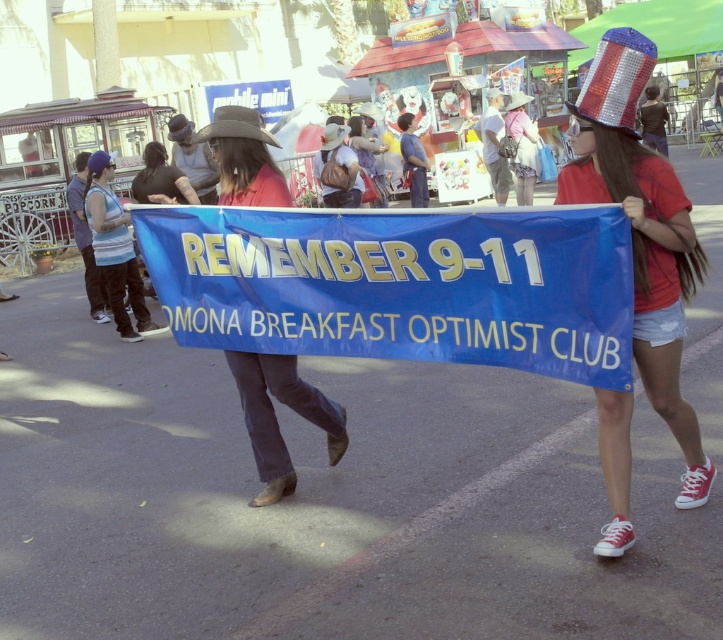
Question: Estimate the real-world distances between objects in this image. Which object is farther from the blue fabric banner at center?

Choices:
 (A) shiny sequined hat at upper right
 (B) matte red shirt at center

Answer: (A)

Question: In this image, where is shiny sequined hat at upper right located relative to matte red shirt at center?

Choices:
 (A) below
 (B) above

Answer: (B)

Question: Does shiny sequined hat at upper right appear on the right side of matte red shirt at center?

Choices:
 (A) yes
 (B) no

Answer: (A)

Question: Considering the real-world distances, which object is farthest from the blue fabric banner at center?

Choices:
 (A) matte red shirt at center
 (B) shiny sequined hat at upper right

Answer: (B)

Question: Which object appears farthest from the camera in this image?

Choices:
 (A) matte red shirt at center
 (B) blue fabric banner at center
 (C) shiny sequined hat at upper right

Answer: (A)

Question: Is blue fabric banner at center below matte red shirt at center?

Choices:
 (A) yes
 (B) no

Answer: (B)